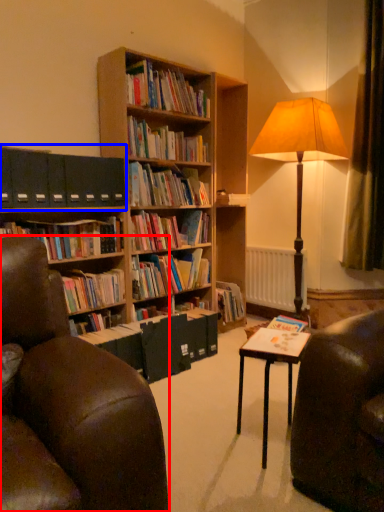
Question: Which point is further to the camera, chair (highlighted by a red box) or shelf (highlighted by a blue box)?

Choices:
 (A) chair
 (B) shelf

Answer: (B)